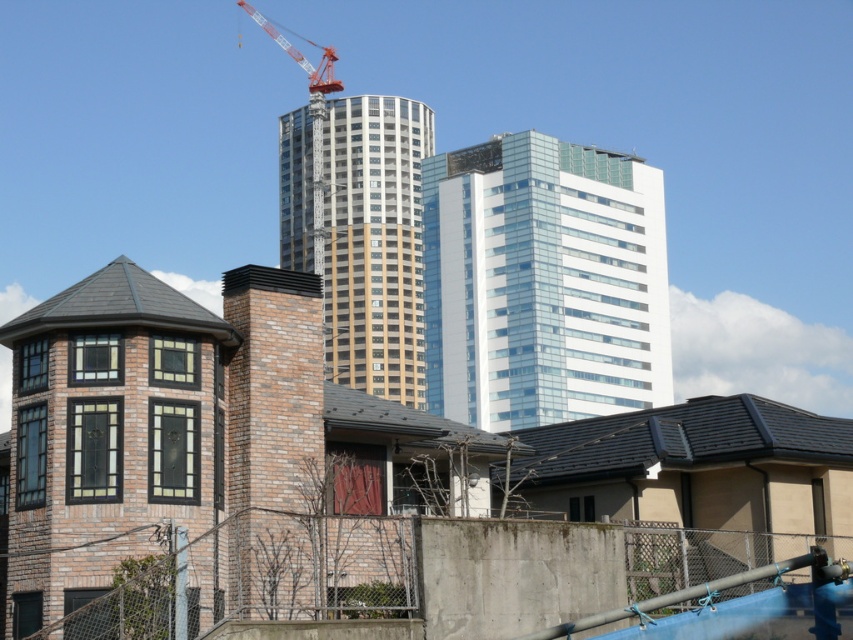
Who is shorter, transparent glass building at center or red metallic crane at upper center?

transparent glass building at center is shorter.

Is the position of transparent glass building at center less distant than that of red metallic crane at upper center?

That is True.

Who is more distant from viewer, (486, 360) or (264, 17)?

The point (264, 17) is behind.

You are a GUI agent. You are given a task and a screenshot of the screen. Output one action in this format:
    pyautogui.click(x=<x>, y=<y>)
    Task: Click on the transparent glass building at center
    
    Given the screenshot: What is the action you would take?
    pyautogui.click(x=543, y=282)

Does beige glass tower at center appear on the right side of red metallic crane at upper center?

Indeed, beige glass tower at center is positioned on the right side of red metallic crane at upper center.

Which is more to the right, beige glass tower at center or red metallic crane at upper center?

From the viewer's perspective, beige glass tower at center appears more on the right side.

Image resolution: width=853 pixels, height=640 pixels. What do you see at coordinates (361, 236) in the screenshot?
I see `beige glass tower at center` at bounding box center [361, 236].

Find the location of a particular element. Image resolution: width=853 pixels, height=640 pixels. beige glass tower at center is located at coordinates (361, 236).

Does transparent glass building at center have a larger size compared to beige glass tower at center?

No.

Does transparent glass building at center have a lesser height compared to beige glass tower at center?

Correct, transparent glass building at center is not as tall as beige glass tower at center.

The width and height of the screenshot is (853, 640). Find the location of `transparent glass building at center`. transparent glass building at center is located at coordinates (543, 282).